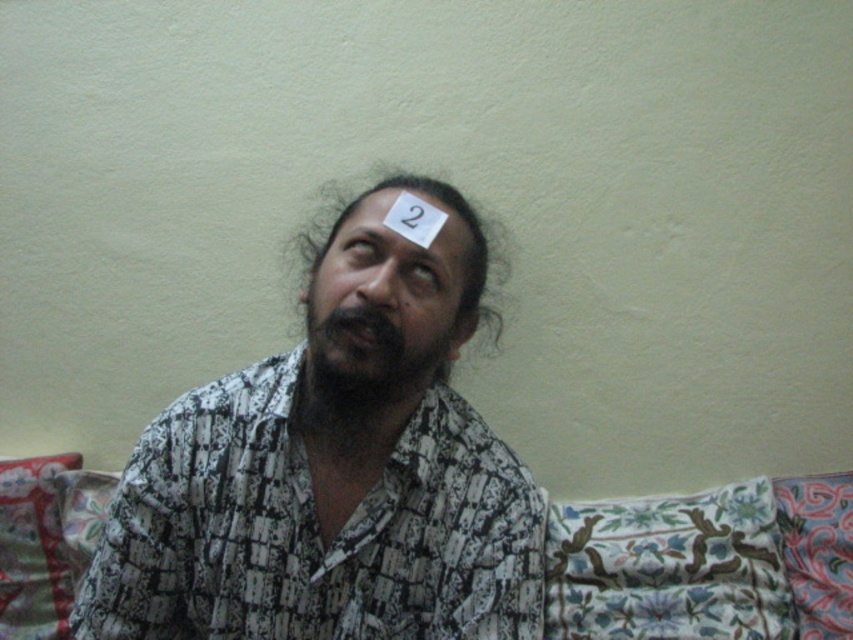
Question: From the image, what is the correct spatial relationship of floral fabric pillow at lower right in relation to matte black face at center?

Choices:
 (A) above
 (B) below

Answer: (B)

Question: Which point is farther to the camera?

Choices:
 (A) (364, 378)
 (B) (213, 621)
 (C) (482, 273)

Answer: (C)

Question: Which point is farther to the camera?

Choices:
 (A) white paper at center
 (B) matte black face at center

Answer: (A)

Question: Can you confirm if matte black face at center is positioned to the right of brown hair at upper center?

Choices:
 (A) no
 (B) yes

Answer: (A)

Question: Can you confirm if black fuzzy beard at center is positioned to the right of matte black face at center?

Choices:
 (A) yes
 (B) no

Answer: (A)

Question: Which of the following is the closest to the observer?

Choices:
 (A) (434, 237)
 (B) (747, 582)
 (C) (350, 216)

Answer: (A)